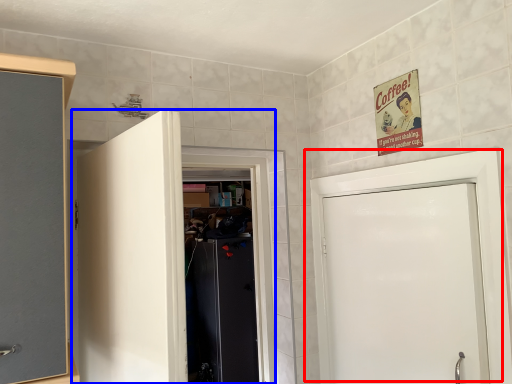
Question: Which object is further to the camera taking this photo, door (highlighted by a red box) or door (highlighted by a blue box)?

Choices:
 (A) door
 (B) door

Answer: (A)